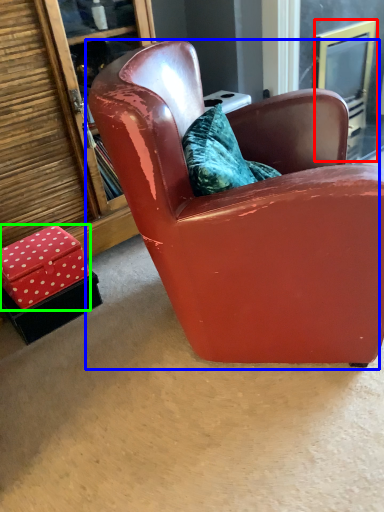
Question: Which object is the farthest from screen door (highlighted by a red box)? Choose among these: chair (highlighted by a blue box) or box (highlighted by a green box).

Choices:
 (A) chair
 (B) box

Answer: (B)